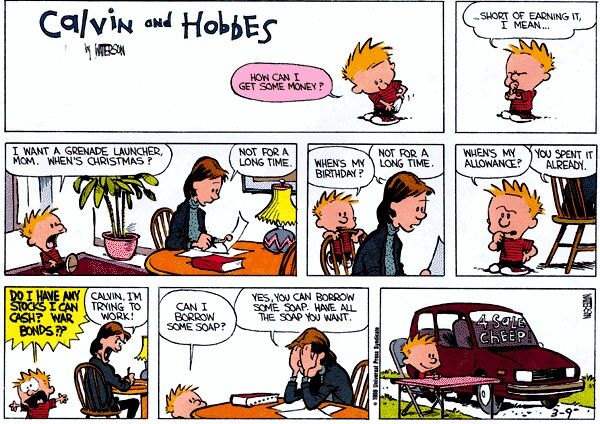
This screenshot has height=424, width=600. Find the location of `panels`. panels is located at coordinates (376, 77), (473, 117), (470, 220), (406, 237), (187, 217), (113, 357), (266, 360), (404, 349).